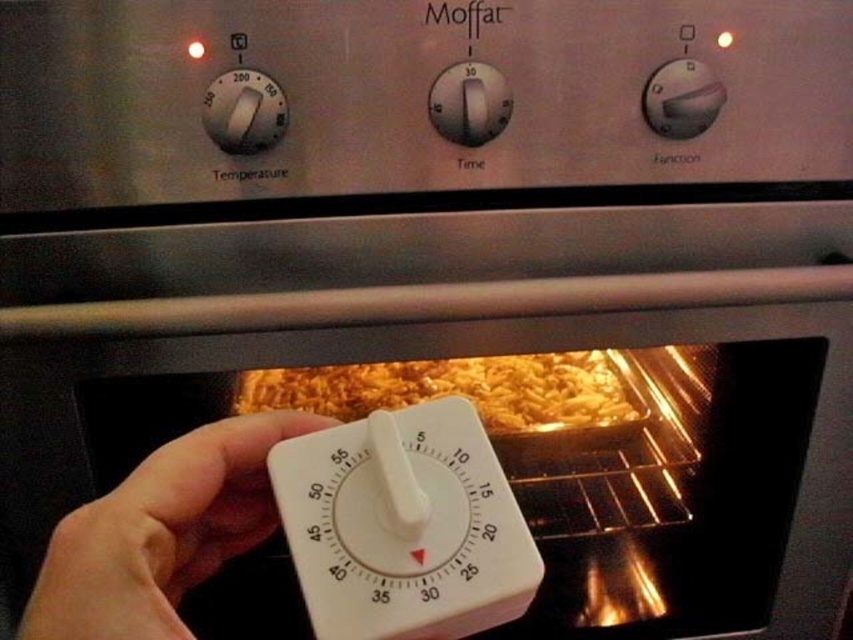
You are a chef preparing pasta in the Moffat oven. You need to check if the white plastic timer at lower center can fit into the timer slot on the oven door, which is designed to hold items no thicker than the golden brown pasta at center. Will it fit?

The white plastic timer at lower center is thinner than the golden brown pasta at center, so it will fit into the timer slot on the oven door since its thickness is less than the maximum allowed by the pasta.